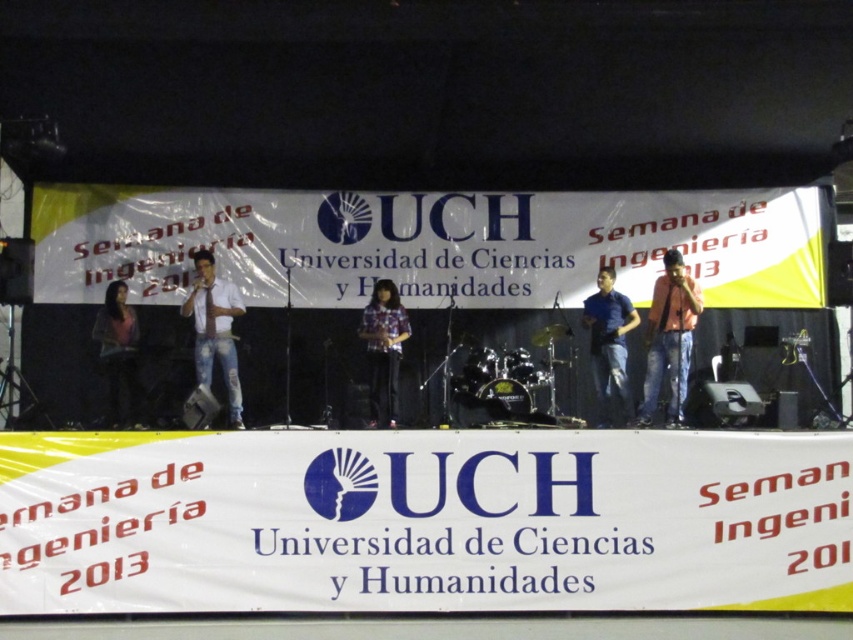
Who is higher up, matte black shirt at right or plaid fabric shirt at center?

Positioned higher is matte black shirt at right.

Image resolution: width=853 pixels, height=640 pixels. What do you see at coordinates (669, 339) in the screenshot?
I see `matte black shirt at right` at bounding box center [669, 339].

Is point (651, 353) positioned before point (368, 348)?

Yes.

The height and width of the screenshot is (640, 853). What are the coordinates of `matte black shirt at right` in the screenshot? It's located at [x=669, y=339].

Can you confirm if matte black shirt at right is bigger than matte black dress at left?

Correct, matte black shirt at right is larger in size than matte black dress at left.

Measure the distance between matte black shirt at right and camera.

39.88 feet

I want to click on matte black shirt at right, so click(669, 339).

Does white denim jeans at center appear on the right side of plaid fabric shirt at center?

No, white denim jeans at center is not to the right of plaid fabric shirt at center.

Is white denim jeans at center taller than plaid fabric shirt at center?

A: Indeed, white denim jeans at center has a greater height compared to plaid fabric shirt at center.

You are a GUI agent. You are given a task and a screenshot of the screen. Output one action in this format:
    pyautogui.click(x=<x>, y=<y>)
    Task: Click on the white denim jeans at center
    Image resolution: width=853 pixels, height=640 pixels.
    Given the screenshot: What is the action you would take?
    pyautogui.click(x=213, y=330)